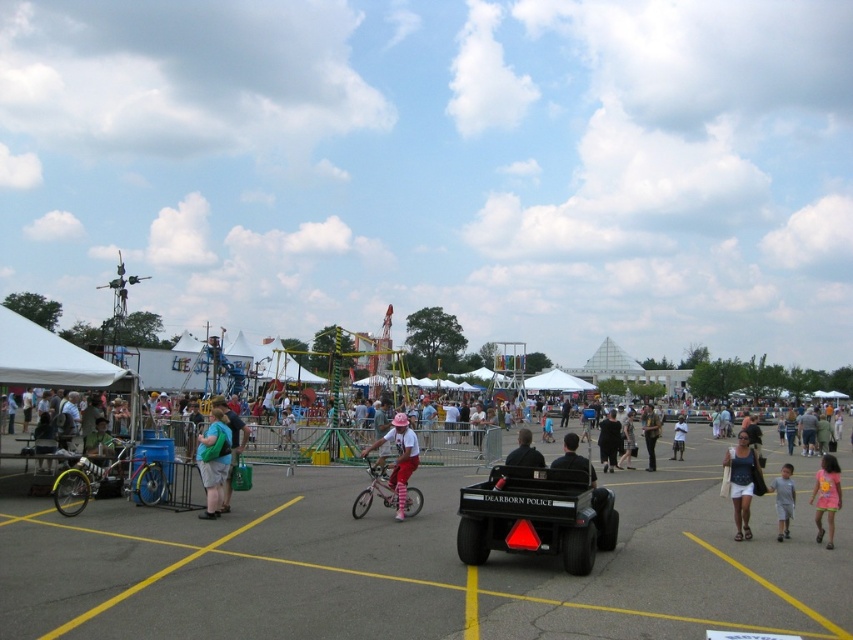
Is pink fabric dress at lower right bigger than black fabric dress at center?

Correct, pink fabric dress at lower right is larger in size than black fabric dress at center.

In order to click on pink fabric dress at lower right in this screenshot , I will do `click(827, 497)`.

Who is shorter, pink fabric dress at lower right or light blue shirt at center?

pink fabric dress at lower right is shorter.

Is pink fabric dress at lower right above light blue shirt at center?

Indeed, pink fabric dress at lower right is positioned over light blue shirt at center.

I want to click on pink fabric dress at lower right, so click(x=827, y=497).

Is point (485, 429) more distant than point (773, 481)?

That is True.

Does pink fabric pants at center have a lesser width compared to gray fabric shirt at lower right?

In fact, pink fabric pants at center might be wider than gray fabric shirt at lower right.

Where is `pink fabric pants at center`? This screenshot has height=640, width=853. pink fabric pants at center is located at coordinates (457, 445).